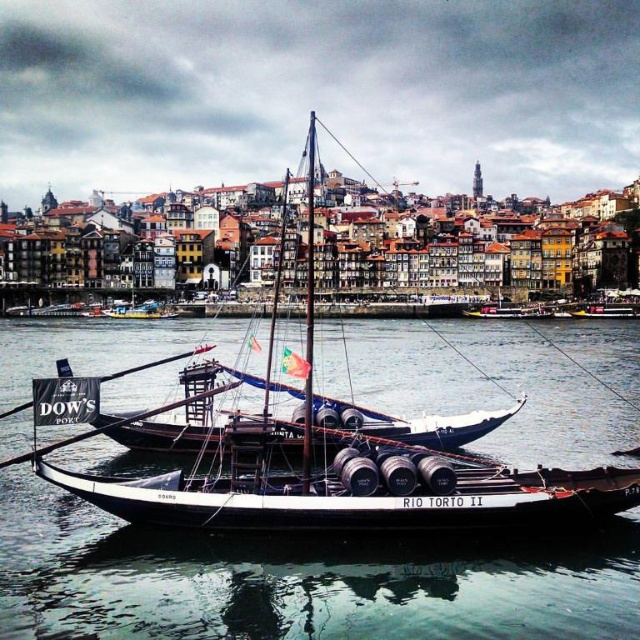
Question: Can you confirm if clear water at center is wider than wooden barrel boat at center?

Choices:
 (A) no
 (B) yes

Answer: (B)

Question: Which object appears closest to the camera in this image?

Choices:
 (A) clear water at center
 (B) wooden barrel boat at center

Answer: (A)

Question: Which object is farther from the camera taking this photo?

Choices:
 (A) wooden barrel boat at center
 (B) clear water at center

Answer: (A)

Question: Is clear water at center to the right of wooden barrel boat at center from the viewer's perspective?

Choices:
 (A) no
 (B) yes

Answer: (A)

Question: Can you confirm if clear water at center is smaller than wooden barrel boat at center?

Choices:
 (A) yes
 (B) no

Answer: (A)